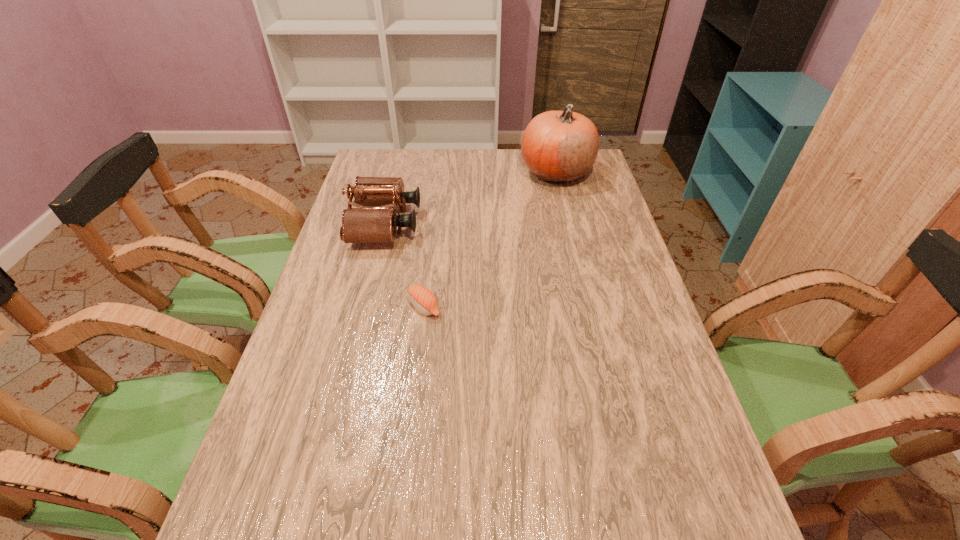
This screenshot has width=960, height=540. I want to click on the tallest object, so (557, 146).

The image size is (960, 540). Identify the location of pumpkin. (557, 146).

In order to click on binoculars in this screenshot , I will do `click(364, 224)`.

Locate an element on the screen. The image size is (960, 540). the second nearest object is located at coordinates 364,224.

Locate an element on the screen. The height and width of the screenshot is (540, 960). the shortest object is located at coordinates click(x=422, y=298).

Locate an element on the screen. Image resolution: width=960 pixels, height=540 pixels. the nearest object is located at coordinates (422, 298).

You are a GUI agent. You are given a task and a screenshot of the screen. Output one action in this format:
    pyautogui.click(x=<x>, y=<y>)
    Task: Click on the vacant area situated on the front of the farthest object
    The height and width of the screenshot is (540, 960).
    Given the screenshot: What is the action you would take?
    pyautogui.click(x=578, y=261)

I want to click on vacant space situated through the eyepieces of the leftmost object, so click(510, 224).

At what (x,y) coordinates should I click in order to perform the action: click on vacant space located on the right of the nearest object. Please return your answer as a coordinate pair (x, y). The height and width of the screenshot is (540, 960). Looking at the image, I should click on (584, 307).

Where is `object at the far edge`? object at the far edge is located at coordinates (557, 146).